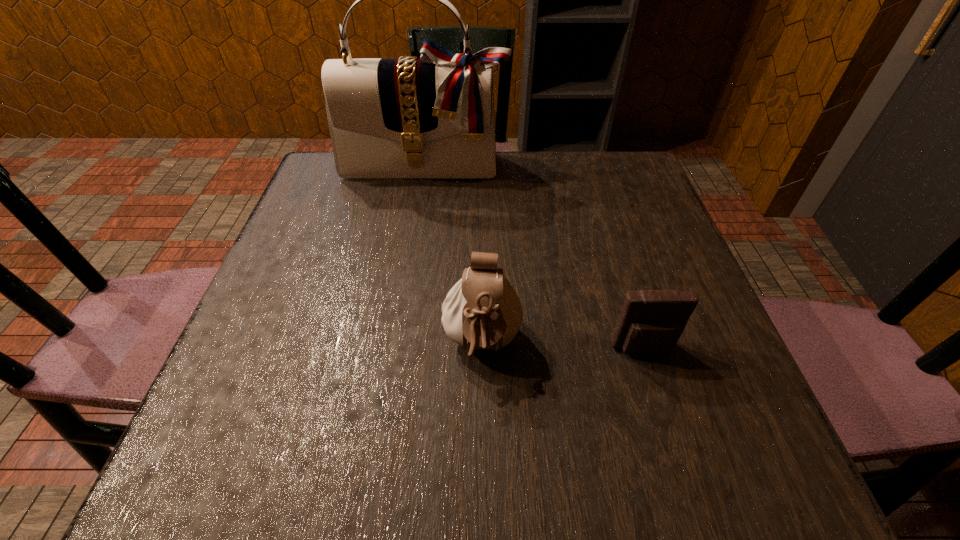
Image resolution: width=960 pixels, height=540 pixels. What are the coordinates of `empty space between the left pouch and the farthest object` in the screenshot? It's located at pos(453,255).

This screenshot has width=960, height=540. What are the coordinates of `free area in between the rightmost object and the left pouch` in the screenshot? It's located at (563, 347).

The width and height of the screenshot is (960, 540). I want to click on empty space that is in between the shorter pouch and the tallest object, so click(534, 258).

Where is `empty space between the farthest object and the right pouch`? This screenshot has width=960, height=540. empty space between the farthest object and the right pouch is located at coordinates (534, 258).

The width and height of the screenshot is (960, 540). Find the location of `vacant area that lies between the tallest object and the left pouch`. vacant area that lies between the tallest object and the left pouch is located at coordinates (453, 255).

Find the location of a particular element. The image size is (960, 540). vacant area between the rightmost object and the taller pouch is located at coordinates (563, 347).

Locate an element on the screen. Image resolution: width=960 pixels, height=540 pixels. empty space that is in between the satchel and the second tallest object is located at coordinates (453, 255).

The width and height of the screenshot is (960, 540). What are the coordinates of `vacant space that is in between the tallest object and the rightmost object` in the screenshot? It's located at [x=534, y=258].

In order to click on free spot between the taller pouch and the farthest object in this screenshot , I will do click(453, 255).

Find the location of `the closest object to the taller pouch`. the closest object to the taller pouch is located at coordinates click(x=651, y=322).